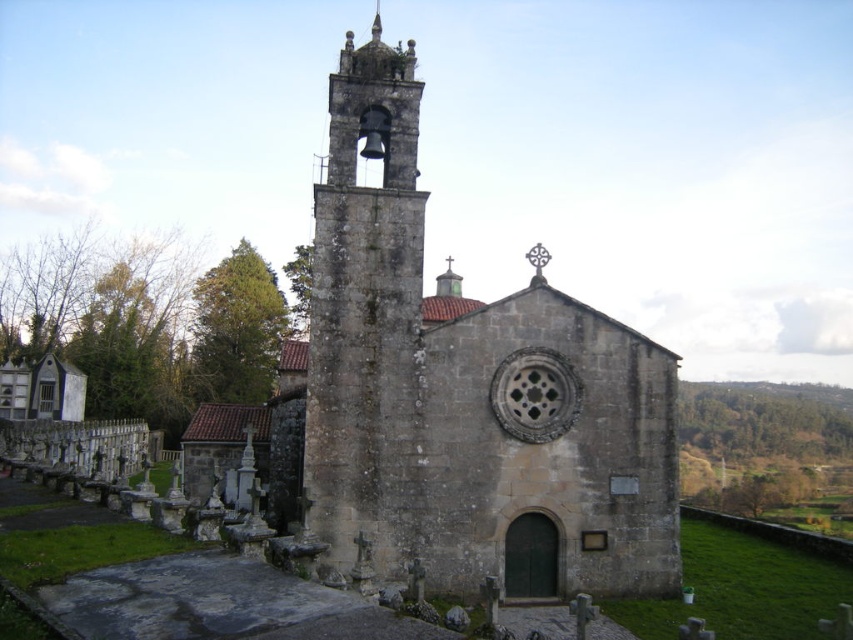
Measure the distance from stone church at center to stone bell tower at center.

A distance of 5.97 meters exists between stone church at center and stone bell tower at center.

What do you see at coordinates (460, 396) in the screenshot? I see `stone church at center` at bounding box center [460, 396].

This screenshot has height=640, width=853. Identify the location of stone church at center. (460, 396).